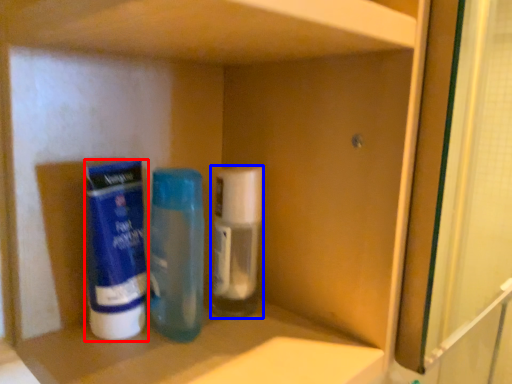
Question: Which point is closer to the camera, cleaning product (highlighted by a red box) or bottle (highlighted by a blue box)?

Choices:
 (A) cleaning product
 (B) bottle

Answer: (A)